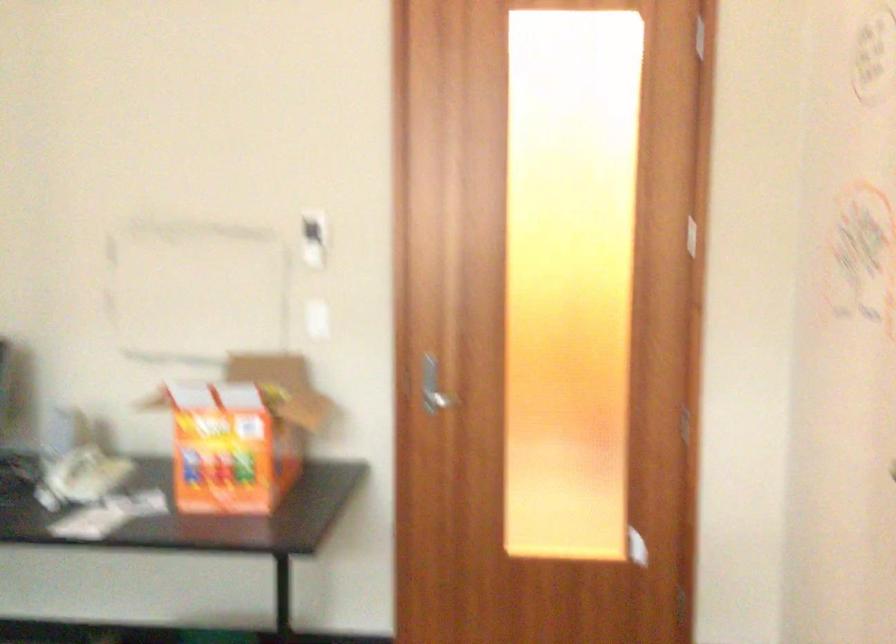
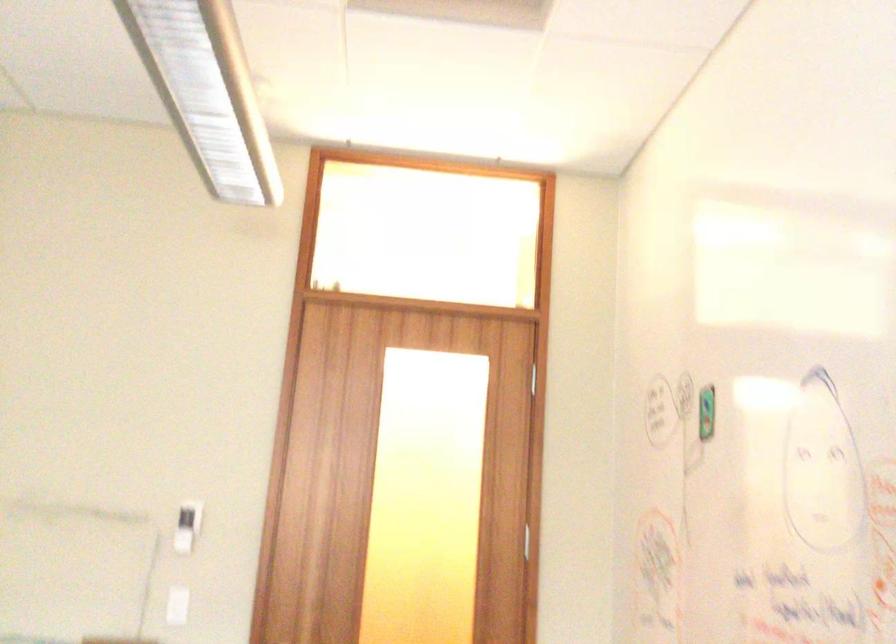
Question: Which direction would the cameraman need to move to produce the second image? Reply with the corresponding letter.

Choices:
 (A) Left
 (B) Right
 (C) Forward
 (D) Backward

Answer: (D)